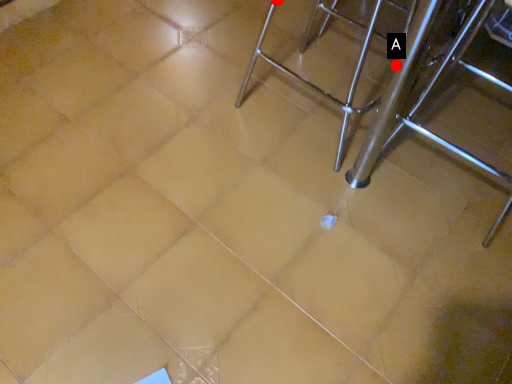
Question: Two points are circled on the image, labeled by A and B beside each circle. Which point is closer to the camera?

Choices:
 (A) A is closer
 (B) B is closer

Answer: (A)